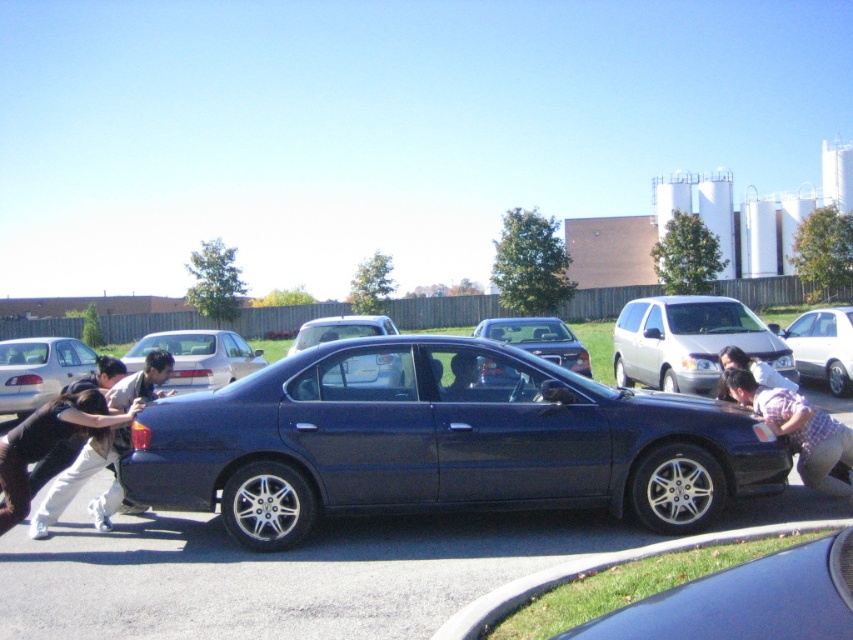
You are a pedestrian standing near the white cotton pants at lower left and the matte black sedan at center. Which object is closer to you?

The white cotton pants at lower left is closer to you because it is in front of the matte black sedan at center.

You are a driver trying to park your car in a parking lot. You see two silver sedans parked in the way. Which sedan should you move first to create space, the matte silver sedan at left or the silver metallic sedan at center?

You should move the silver metallic sedan at center first because it is behind the matte silver sedan at left, so moving it first will allow you to create more space for parking.